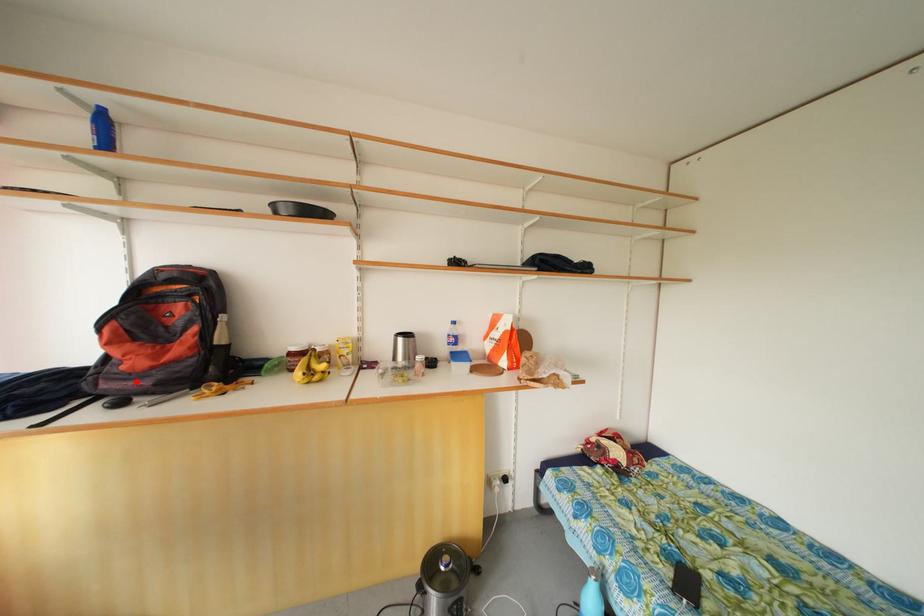
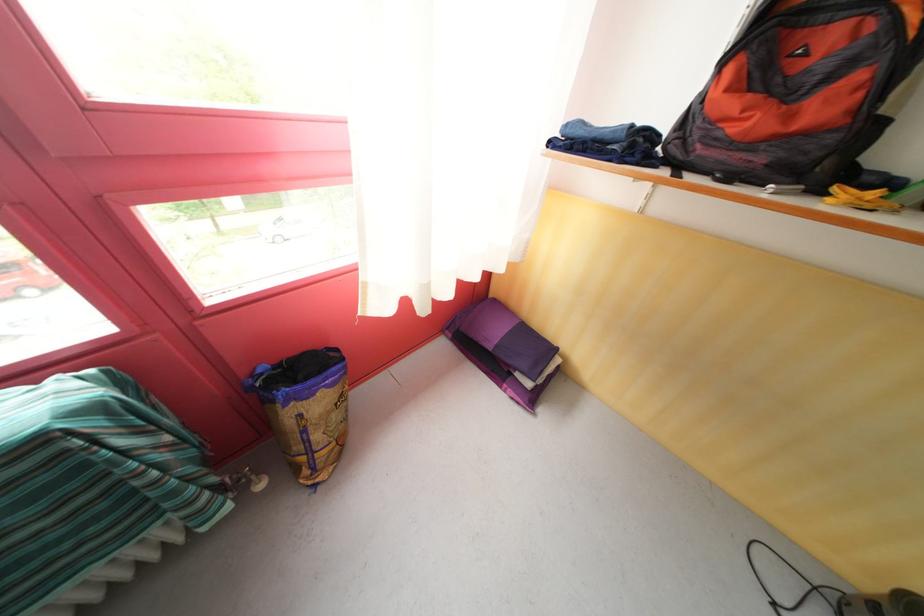
The point at the highlighted location is marked in the first image. Where is the corresponding point in the second image?

(736, 151)